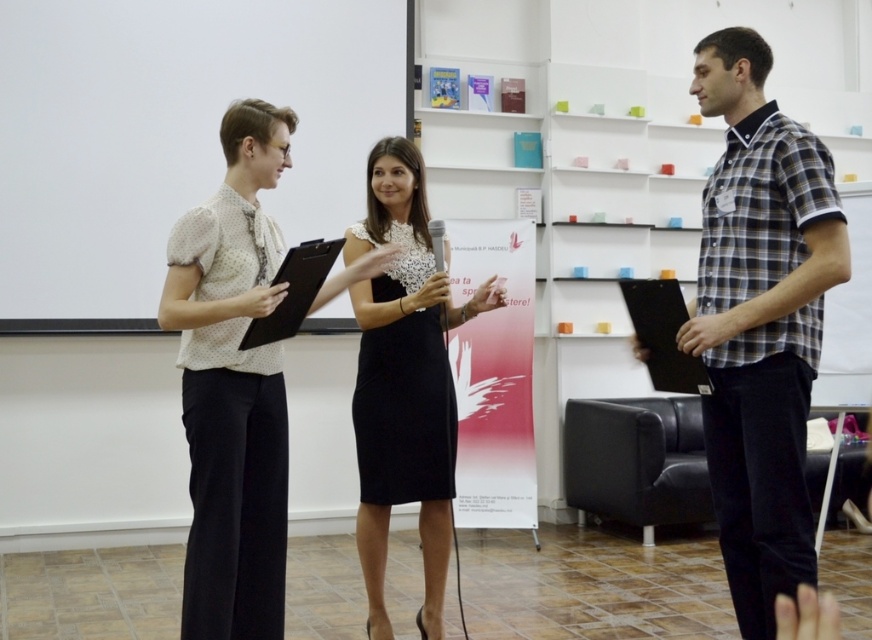
Looking at this image, you are standing at point A located at point (x=413, y=428) and want to walk to point B at point (x=687, y=388). Can you walk directly towards point B without going through any obstacles?

Point (x=413, y=428) is behind point (x=687, y=388), so you can walk directly towards point B without any obstacles in your path.

You are an event organizer who needs to determine the spatial relationship between the black lace dress at center and the black matte clipboard at right. Which object takes up more space in the image?

The black lace dress at center is larger in size than the black matte clipboard at right, so it takes up more space in the image.

You are organizing a small event and need to decide whether to place a decorative item on the table between the checkered fabric shirt at right and the black matte clipboard at center. Considering their sizes, which object requires more space horizontally?

The checkered fabric shirt at right requires more horizontal space because its width is larger than the black matte clipboard at center.